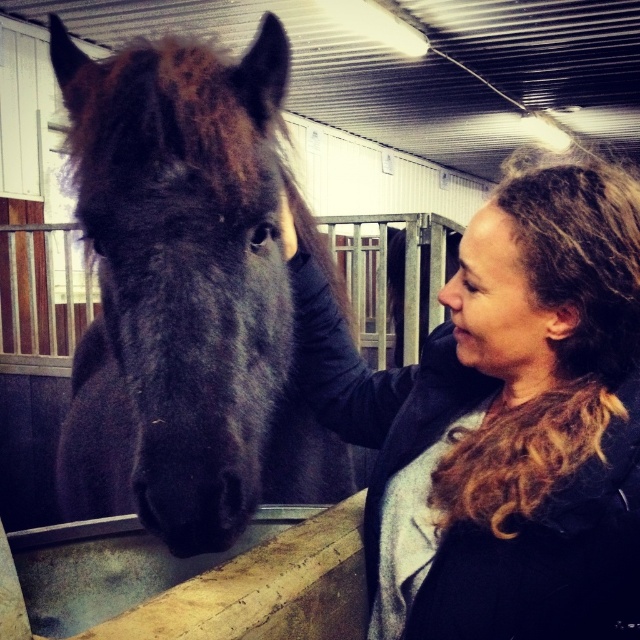
Question: Estimate the real-world distances between objects in this image. Which object is closer to the dark brown fuzzy horse at center?

Choices:
 (A) matte black nose at center
 (B) curly hair at upper right

Answer: (A)

Question: Estimate the real-world distances between objects in this image. Which object is closer to the dark brown fuzzy horse at center?

Choices:
 (A) curly hair at upper right
 (B) matte black nose at center

Answer: (B)

Question: Is dark brown fuzzy horse at center wider than curly hair at upper right?

Choices:
 (A) no
 (B) yes

Answer: (B)

Question: Which object is farther from the camera taking this photo?

Choices:
 (A) curly hair at upper right
 (B) matte black nose at center
 (C) dark brown fuzzy horse at center

Answer: (B)

Question: Can you confirm if curly hair at upper right is positioned to the right of matte black nose at center?

Choices:
 (A) no
 (B) yes

Answer: (A)

Question: Does dark brown fuzzy horse at center come behind curly hair at upper right?

Choices:
 (A) no
 (B) yes

Answer: (B)